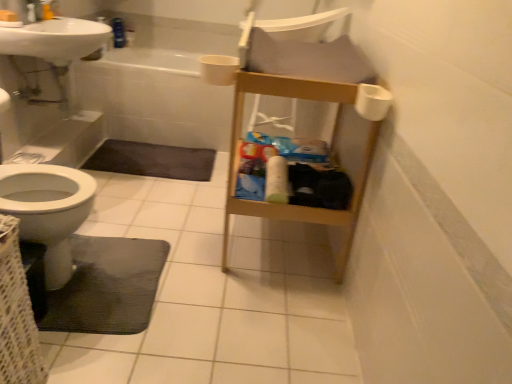
Where is `free space that is in between black rubber bath mat at lower left, which is the 1th bath mat in front-to-back order, and dark gray matte bath mat at lower left, which appears as the second bath mat when ordered from the bottom`? free space that is in between black rubber bath mat at lower left, which is the 1th bath mat in front-to-back order, and dark gray matte bath mat at lower left, which appears as the second bath mat when ordered from the bottom is located at coordinates (148, 204).